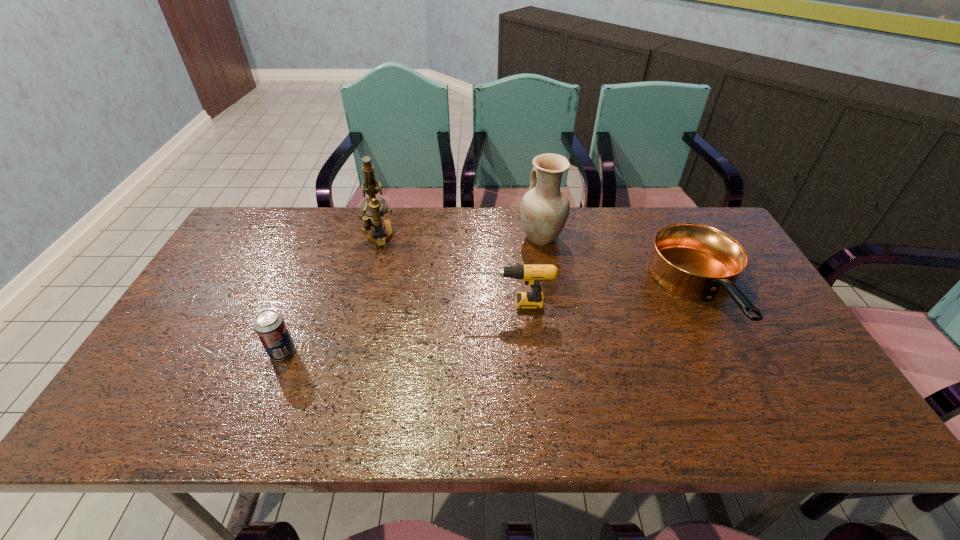
What are the coordinates of `free space at the far left corner` in the screenshot? It's located at (261, 228).

I want to click on vacant area at the near left corner of the desktop, so click(x=152, y=435).

Identify the location of free space between the leftmost object and the rightmost object. This screenshot has width=960, height=540. (492, 324).

Locate an element on the screen. This screenshot has height=540, width=960. unoccupied area between the second object from left to right and the leftmost object is located at coordinates (330, 294).

Find the location of a particular element. empty space that is in between the beer can and the pottery is located at coordinates [x=412, y=295].

Where is `free space between the leftmost object and the rightmost object`? This screenshot has width=960, height=540. free space between the leftmost object and the rightmost object is located at coordinates (492, 324).

Locate an element on the screen. This screenshot has height=540, width=960. vacant space in between the leftmost object and the rightmost object is located at coordinates (492, 324).

At what (x,y) coordinates should I click in order to perform the action: click on vacant area between the leftmost object and the rightmost object. Please return your answer as a coordinate pair (x, y). The width and height of the screenshot is (960, 540). Looking at the image, I should click on (492, 324).

Where is `vacant region between the leftmost object and the drill`? The width and height of the screenshot is (960, 540). vacant region between the leftmost object and the drill is located at coordinates (396, 328).

What are the coordinates of `free spot between the microscope and the drill` in the screenshot? It's located at (444, 270).